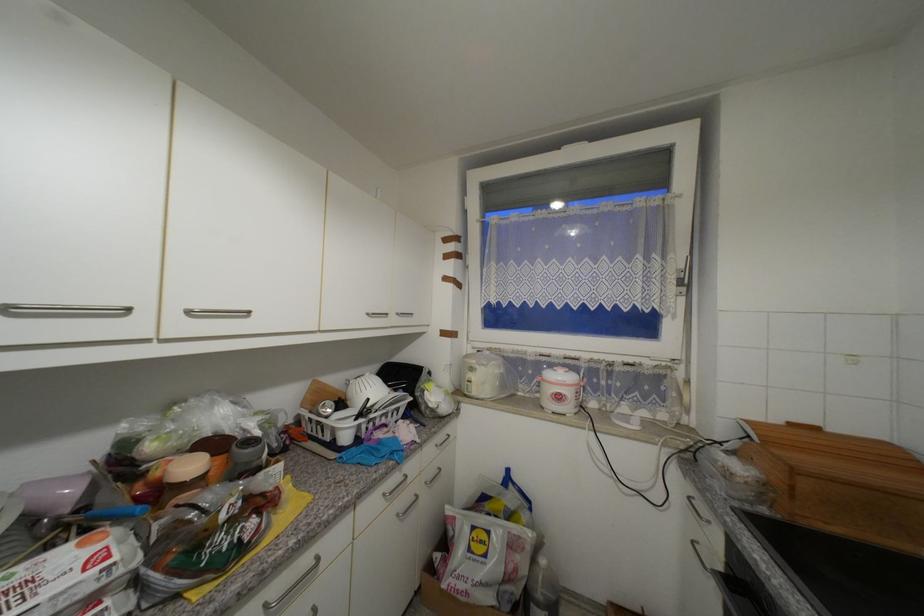
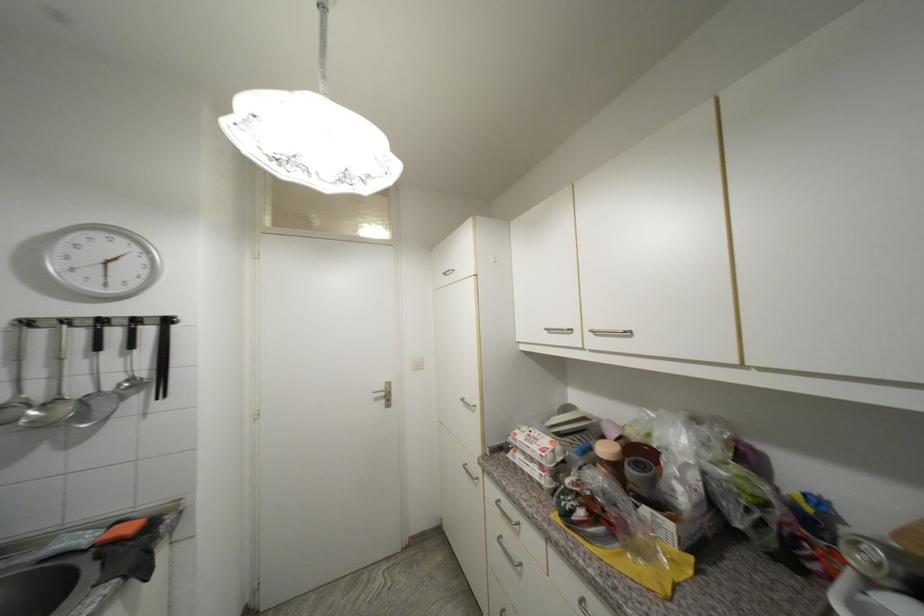
In the second image, find the point that corresponds to (x=26, y=569) in the first image.

(548, 436)